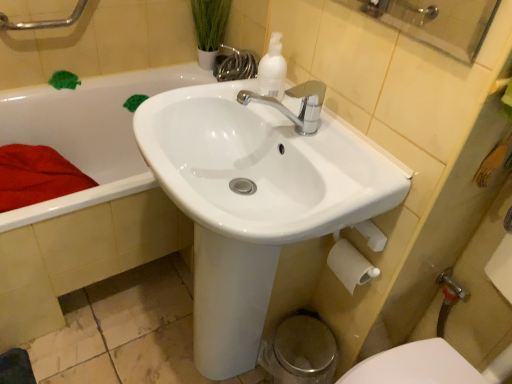
Find the location of a particular element. This screenshot has width=512, height=384. free space to the left of white matte pump bottle at upper center is located at coordinates coord(220,97).